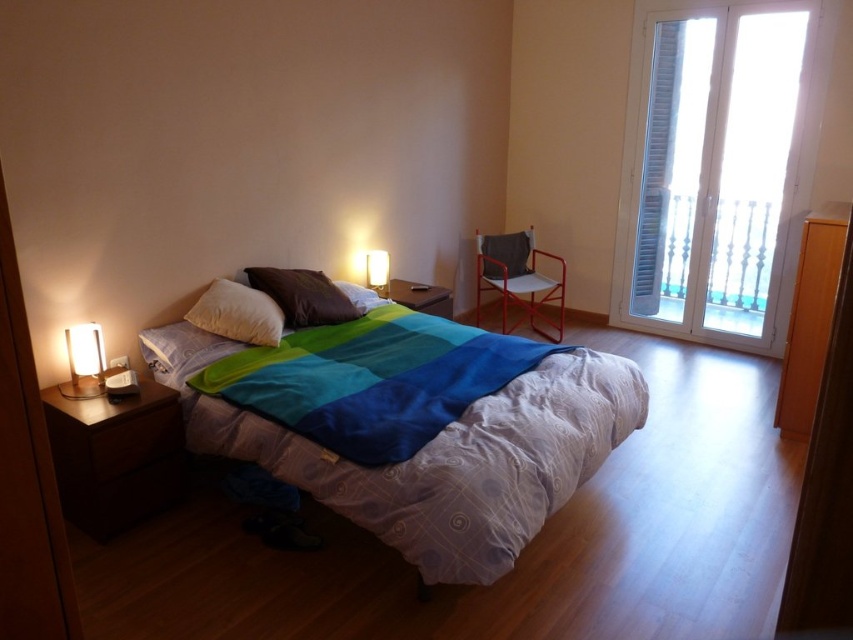
Consider the image. You are organizing the bedroom and need to place a new decorative item between the textured cotton bed at center and the matte white lamp at left. Based on their positions, which side of the lamp should you place it on?

The textured cotton bed at center is positioned on the right side of the matte white lamp at left, so you should place the decorative item to the right of the matte white lamp at left to be between them.